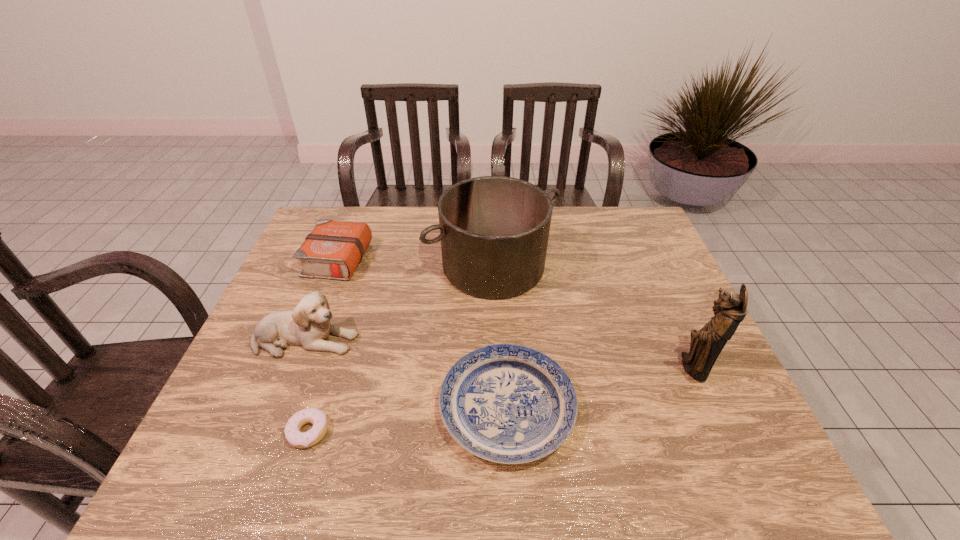
Image resolution: width=960 pixels, height=540 pixels. I want to click on the tallest object, so click(730, 309).

Locate an element on the screen. figurine is located at coordinates (730, 309).

Image resolution: width=960 pixels, height=540 pixels. What are the coordinates of `pan` in the screenshot? It's located at (494, 230).

Identify the location of the third tallest object. (308, 325).

Identify the location of the fourth tallest object. The image size is (960, 540). (333, 250).

Image resolution: width=960 pixels, height=540 pixels. I want to click on the fifth tallest object, so click(506, 403).

Identify the location of doughnut. (296, 438).

Locate an element on the screen. The width and height of the screenshot is (960, 540). vacant region located 0.300m on the front-facing side of the rightmost object is located at coordinates tap(546, 367).

The image size is (960, 540). I want to click on free space located 0.150m on the front-facing side of the rightmost object, so click(x=608, y=367).

I want to click on vacant space located on the front-facing side of the rightmost object, so click(x=591, y=367).